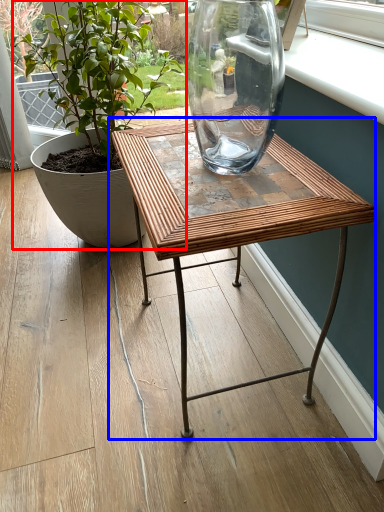
Question: Among these objects, which one is farthest to the camera, houseplant (highlighted by a red box) or table (highlighted by a blue box)?

Choices:
 (A) houseplant
 (B) table

Answer: (A)